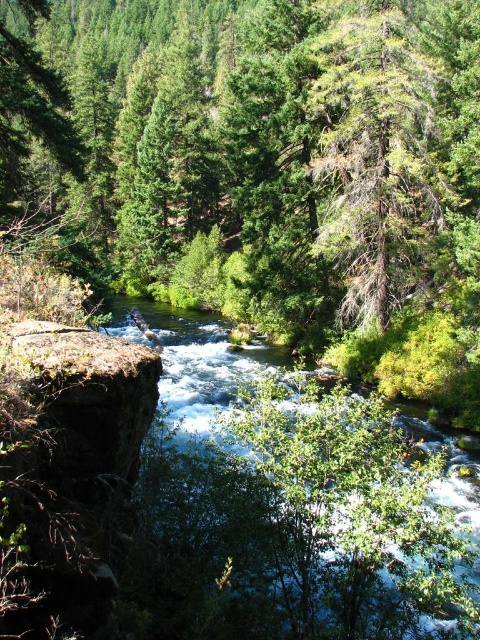
Question: Can you confirm if clear water at center is positioned above green textured tree at upper right?

Choices:
 (A) yes
 (B) no

Answer: (B)

Question: Does clear water at center have a smaller size compared to green textured tree at upper right?

Choices:
 (A) yes
 (B) no

Answer: (A)

Question: Is clear water at center closer to the viewer compared to green textured tree at upper right?

Choices:
 (A) no
 (B) yes

Answer: (B)

Question: Which point appears farthest from the camera in this image?

Choices:
 (A) (211, 531)
 (B) (332, 156)

Answer: (B)